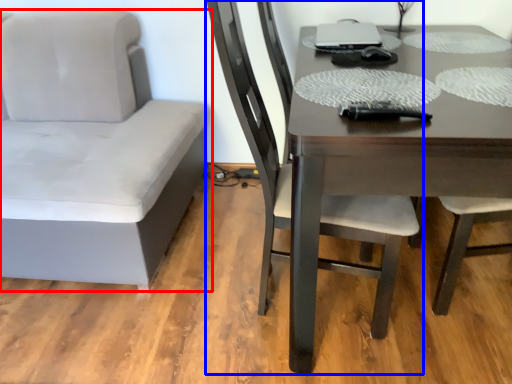
Question: Which of the following is the farthest to the observer, chair (highlighted by a red box) or chair (highlighted by a blue box)?

Choices:
 (A) chair
 (B) chair

Answer: (A)